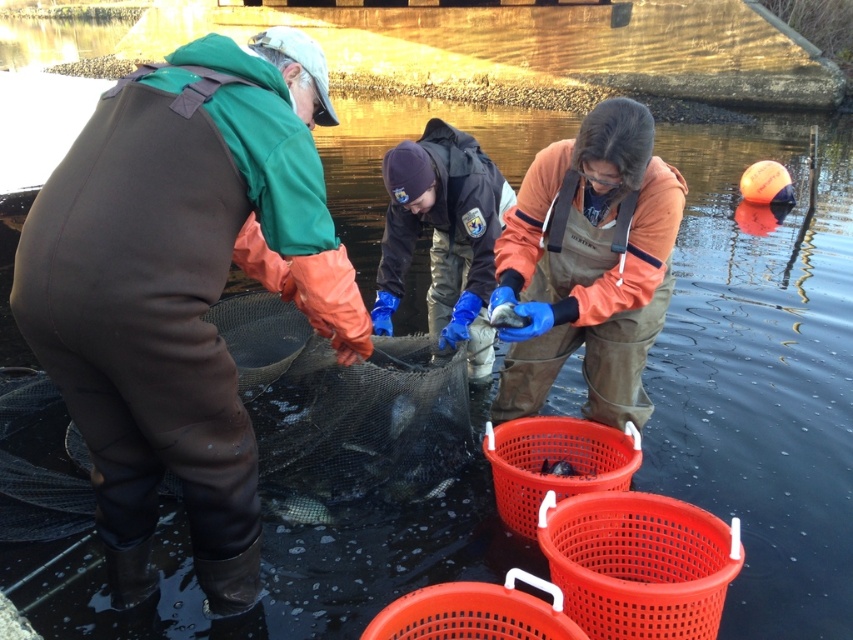
Question: Considering the relative positions of brown waterproof overalls at left and brown rubber net at center in the image provided, where is brown waterproof overalls at left located with respect to brown rubber net at center?

Choices:
 (A) above
 (B) below

Answer: (A)

Question: Can you confirm if brown waterproof overalls at left is positioned above brown rubber net at center?

Choices:
 (A) yes
 (B) no

Answer: (A)

Question: Which of the following is the farthest from the observer?

Choices:
 (A) (32, 292)
 (B) (314, 499)

Answer: (B)

Question: Which of the following is the closest to the observer?

Choices:
 (A) brown waterproof overalls at left
 (B) smooth gray fish at center
 (C) shiny silver fish at center

Answer: (A)

Question: Is shiny silver fish at center smaller than smooth gray fish at center?

Choices:
 (A) no
 (B) yes

Answer: (A)

Question: Which point is closer to the camera taking this photo?

Choices:
 (A) (399, 417)
 (B) (347, 378)
 (C) (322, 502)

Answer: (B)